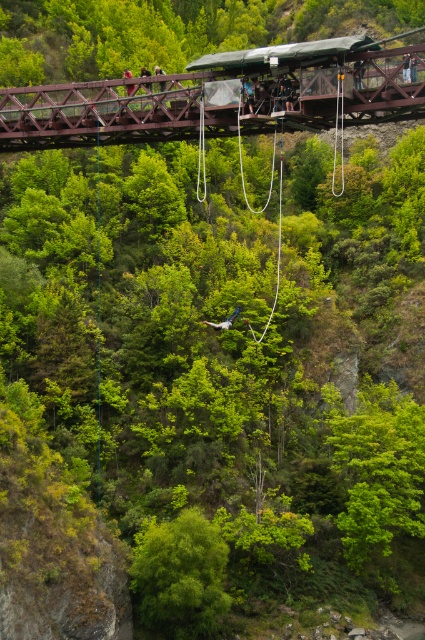
Does brown wooden bridge at upper center appear over white fabric parachute at center?

Indeed, brown wooden bridge at upper center is positioned over white fabric parachute at center.

Can you confirm if brown wooden bridge at upper center is shorter than white fabric parachute at center?

In fact, brown wooden bridge at upper center may be taller than white fabric parachute at center.

Is point (206, 72) in front of point (232, 314)?

Yes, point (206, 72) is in front of point (232, 314).

At what (x,y) coordinates should I click in order to perform the action: click on brown wooden bridge at upper center. Please return your answer as a coordinate pair (x, y). Looking at the image, I should click on (221, 97).